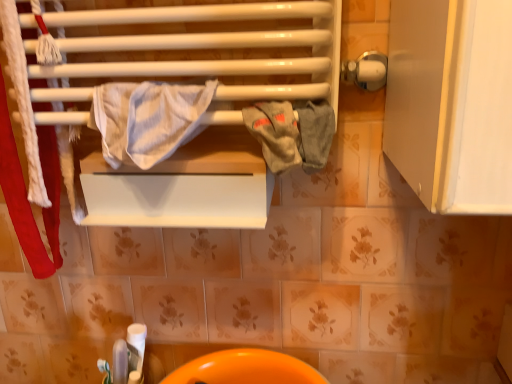
Question: From a real-world perspective, is gray cotton towel at center, the second bath towel when ordered from left to right, positioned above or below white striped fabric at center, which is the first bath towel from left to right?

Choices:
 (A) above
 (B) below

Answer: (B)

Question: Considering the positions of point (274, 148) and point (93, 109), is point (274, 148) closer or farther from the camera than point (93, 109)?

Choices:
 (A) closer
 (B) farther

Answer: (A)

Question: Which object is the farthest from the gray cotton towel at center, which is the 1th bath towel from right to left?

Choices:
 (A) orange glossy sink at lower center
 (B) white striped fabric at center, which is the first bath towel from left to right

Answer: (A)

Question: Which object is positioned closest to the white striped fabric at center, which appears as the 2th bath towel when viewed from the right?

Choices:
 (A) gray cotton towel at center, which is the 1th bath towel from right to left
 (B) orange glossy sink at lower center

Answer: (A)